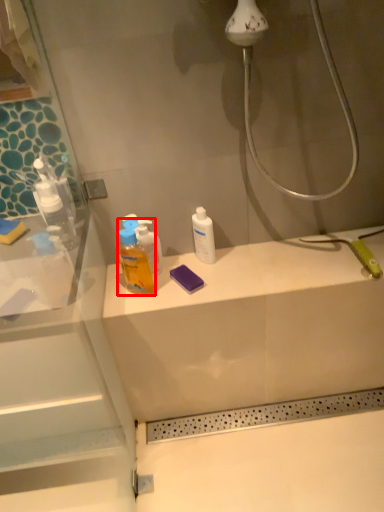
Question: From the image's perspective, considering the relative positions of cleaning product (annotated by the red box) and mouthwash in the image provided, where is cleaning product (annotated by the red box) located with respect to the staircase?

Choices:
 (A) below
 (B) above

Answer: (A)